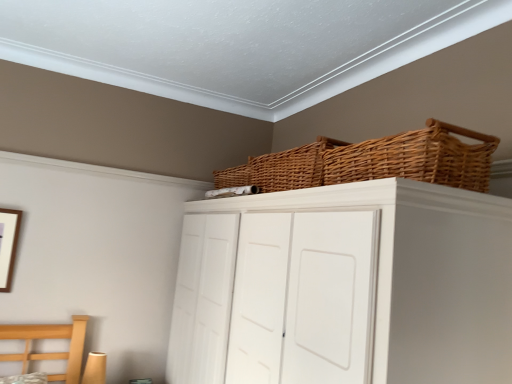
Question: From the image's perspective, is white matte cupboard at upper center positioned above or below wooden picture frame at left?

Choices:
 (A) above
 (B) below

Answer: (B)

Question: In terms of height, does white matte cupboard at upper center look taller or shorter compared to wooden picture frame at left?

Choices:
 (A) short
 (B) tall

Answer: (B)

Question: Which of these objects is positioned farthest from the woven brown basket at upper center, arranged as the second basket when viewed from the back?

Choices:
 (A) woven brown basket at upper center, which ranks as the 1th basket in back-to-front order
 (B) white matte cupboard at upper center
 (C) wooden picture frame at left

Answer: (C)

Question: Which object is the farthest from the woven brown basket at upper center, which ranks as the 1th basket in back-to-front order?

Choices:
 (A) wooden picture frame at left
 (B) white matte cupboard at upper center
 (C) woven brown basket at upper center, positioned as the 1th basket in front-to-back order

Answer: (A)